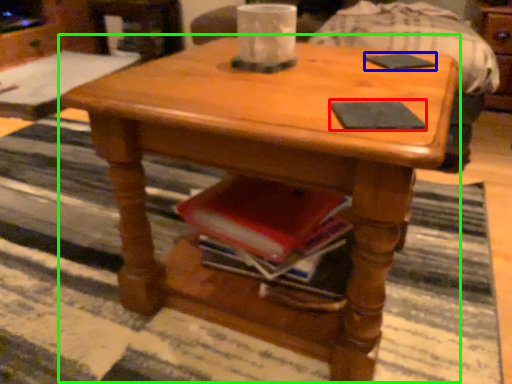
Question: Based on their relative distances, which object is nearer to pad (highlighted by a red box)? Choose from pad (highlighted by a blue box) and coffee table (highlighted by a green box).

Choices:
 (A) pad
 (B) coffee table

Answer: (B)